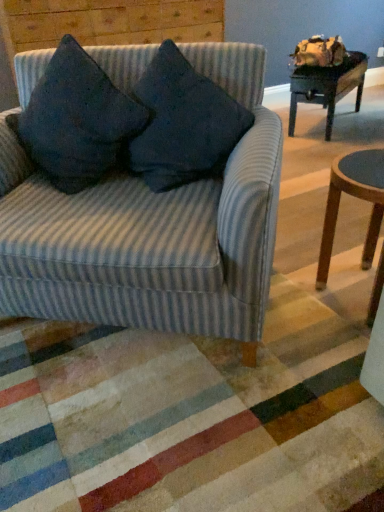
Describe the element at coordinates (77, 120) in the screenshot. The height and width of the screenshot is (512, 384). I see `dark blue fabric pillow at upper left, positioned as the second throw pillow in right-to-left order` at that location.

What do you see at coordinates (356, 197) in the screenshot? This screenshot has width=384, height=512. I see `wooden round stool at lower right` at bounding box center [356, 197].

In order to face dark blue fabric pillow at center, acting as the second throw pillow starting from the left, should I rotate leftwards or rightwards?

You should rotate left by 1.017 degrees.

What do you see at coordinates (183, 123) in the screenshot? The image size is (384, 512). I see `dark blue fabric pillow at center, which appears as the 1th throw pillow when viewed from the right` at bounding box center [183, 123].

At what (x,y) coordinates should I click in order to perform the action: click on dark blue fabric pillow at upper left, which appears as the first throw pillow when viewed from the left. Please return your answer as a coordinate pair (x, y). The image size is (384, 512). Looking at the image, I should click on (77, 120).

I want to click on dresser that is above the wooden round stool at lower right (from a real-world perspective), so click(x=103, y=25).

Is wooden round stool at lower right positioned beyond the bounds of dark blue fabric cushion at upper left?

Indeed, wooden round stool at lower right is completely outside dark blue fabric cushion at upper left.

In terms of height, does wooden round stool at lower right look taller or shorter compared to dark blue fabric cushion at upper left?

In the image, wooden round stool at lower right appears to be shorter than dark blue fabric cushion at upper left.

Is wooden round stool at lower right far from dark blue fabric cushion at upper left?

Yes, wooden round stool at lower right and dark blue fabric cushion at upper left are located far from each other.

Considering the sizes of objects wooden round stool at lower right and dark blue fabric pillow at upper left, positioned as the second throw pillow in right-to-left order, in the image provided, who is taller, wooden round stool at lower right or dark blue fabric pillow at upper left, positioned as the second throw pillow in right-to-left order,?

wooden round stool at lower right is taller.

Would you say wooden round stool at lower right is a long distance from dark blue fabric pillow at upper left, positioned as the second throw pillow in right-to-left order?

No, wooden round stool at lower right is not far away from dark blue fabric pillow at upper left, positioned as the second throw pillow in right-to-left order.

How many degrees apart are the facing directions of wooden round stool at lower right and dark blue fabric pillow at upper left, which appears as the first throw pillow when viewed from the left?

55.5 degrees.

Considering the relative sizes of wooden round stool at lower right and dark blue fabric pillow at upper left, positioned as the second throw pillow in right-to-left order, in the image provided, is wooden round stool at lower right wider than dark blue fabric pillow at upper left, positioned as the second throw pillow in right-to-left order,?

Correct, the width of wooden round stool at lower right exceeds that of dark blue fabric pillow at upper left, positioned as the second throw pillow in right-to-left order.

Is wooden table at upper right aimed at striped fabric couch at left?

No.

Which of these two, wooden table at upper right or striped fabric couch at left, is wider?

striped fabric couch at left.

Which object is positioned more to the left, wooden table at upper right or striped fabric couch at left?

From the viewer's perspective, striped fabric couch at left appears more on the left side.

Considering the sizes of dark blue fabric pillow at upper left, positioned as the second throw pillow in right-to-left order, and wooden table at upper right in the image, is dark blue fabric pillow at upper left, positioned as the second throw pillow in right-to-left order, wider or thinner than wooden table at upper right?

dark blue fabric pillow at upper left, positioned as the second throw pillow in right-to-left order, is wider than wooden table at upper right.

From a real-world perspective, is dark blue fabric pillow at upper left, positioned as the second throw pillow in right-to-left order, positioned above or below wooden table at upper right?

dark blue fabric pillow at upper left, positioned as the second throw pillow in right-to-left order, is above wooden table at upper right.

Based on their sizes in the image, would you say dark blue fabric pillow at upper left, positioned as the second throw pillow in right-to-left order, is bigger or smaller than wooden table at upper right?

In the image, dark blue fabric pillow at upper left, positioned as the second throw pillow in right-to-left order, appears to be smaller than wooden table at upper right.

There is a wooden table at upper right. Where is `the 2nd throw pillow above it (from a real-world perspective)`? the 2nd throw pillow above it (from a real-world perspective) is located at coordinates (77, 120).

Would you say dark blue fabric cushion at upper left is inside or outside dark blue fabric pillow at upper left, which appears as the first throw pillow when viewed from the left?

dark blue fabric cushion at upper left is spatially situated outside dark blue fabric pillow at upper left, which appears as the first throw pillow when viewed from the left.

Considering the sizes of dark blue fabric cushion at upper left and dark blue fabric pillow at upper left, which appears as the first throw pillow when viewed from the left, in the image, is dark blue fabric cushion at upper left taller or shorter than dark blue fabric pillow at upper left, which appears as the first throw pillow when viewed from the left,?

dark blue fabric cushion at upper left is taller than dark blue fabric pillow at upper left, which appears as the first throw pillow when viewed from the left.

Which is more distant, (68,21) or (94,82)?

Point (68,21)

Locate an element on the screen. The image size is (384, 512). dresser positioned vertically above the dark blue fabric pillow at upper left, positioned as the second throw pillow in right-to-left order (from a real-world perspective) is located at coordinates (103, 25).

Is striped fabric couch at left spatially inside dark blue fabric cushion at upper left, or outside of it?

striped fabric couch at left is outside dark blue fabric cushion at upper left.

Which is more distant, (104, 285) or (208, 26)?

Point (208, 26)

From a real-world perspective, is striped fabric couch at left located higher than dark blue fabric cushion at upper left?

Actually, striped fabric couch at left is physically below dark blue fabric cushion at upper left in the real world.

Which is more to the right, striped fabric couch at left or dark blue fabric cushion at upper left?

striped fabric couch at left is more to the right.

Is dark blue fabric pillow at center, acting as the second throw pillow starting from the left, further to the viewer compared to striped fabric couch at left?

Yes, it is.

Could you measure the distance between dark blue fabric pillow at center, acting as the second throw pillow starting from the left, and striped fabric couch at left?

They are 8.32 inches apart.

From the image's perspective, starting from the striped fabric couch at left, which throw pillow is the 1st one above? Please provide its 2D coordinates.

[(183, 123)]

Is dark blue fabric pillow at center, acting as the second throw pillow starting from the left, at the right side of striped fabric couch at left?

Correct, you'll find dark blue fabric pillow at center, acting as the second throw pillow starting from the left, to the right of striped fabric couch at left.

At what (x,y) coordinates should I click in order to perform the action: click on coffee table below the dark blue fabric cushion at upper left (from a real-world perspective). Please return your answer as a coordinate pair (x, y). The width and height of the screenshot is (384, 512). Looking at the image, I should click on (356, 197).

Locate an element on the screen. The image size is (384, 512). coffee table on the right side of dark blue fabric pillow at upper left, positioned as the second throw pillow in right-to-left order is located at coordinates (356, 197).

From the image, which object appears to be nearer to dark blue fabric pillow at upper left, which appears as the first throw pillow when viewed from the left, wooden table at upper right or dark blue fabric pillow at center, which appears as the 1th throw pillow when viewed from the right?

dark blue fabric pillow at center, which appears as the 1th throw pillow when viewed from the right, is closer to dark blue fabric pillow at upper left, which appears as the first throw pillow when viewed from the left.

Based on their spatial positions, is dark blue fabric pillow at center, which appears as the 1th throw pillow when viewed from the right, or striped fabric couch at left closer to wooden table at upper right?

Based on the image, dark blue fabric pillow at center, which appears as the 1th throw pillow when viewed from the right, appears to be nearer to wooden table at upper right.

Which object lies nearer to the anchor point dark blue fabric cushion at upper left, dark blue fabric pillow at upper left, which appears as the first throw pillow when viewed from the left, or dark blue fabric pillow at center, which appears as the 1th throw pillow when viewed from the right?

The object closer to dark blue fabric cushion at upper left is dark blue fabric pillow at upper left, which appears as the first throw pillow when viewed from the left.

Looking at the image, which one is located further to dark blue fabric pillow at center, which appears as the 1th throw pillow when viewed from the right, dark blue fabric pillow at upper left, positioned as the second throw pillow in right-to-left order, or wooden round stool at lower right?

wooden round stool at lower right lies further to dark blue fabric pillow at center, which appears as the 1th throw pillow when viewed from the right, than the other object.

Based on their spatial positions, is wooden round stool at lower right or wooden table at upper right closer to dark blue fabric pillow at center, which appears as the 1th throw pillow when viewed from the right?

wooden round stool at lower right is positioned closer to the anchor dark blue fabric pillow at center, which appears as the 1th throw pillow when viewed from the right.

Which object lies further to the anchor point dark blue fabric pillow at center, which appears as the 1th throw pillow when viewed from the right, striped fabric couch at left or wooden round stool at lower right?

wooden round stool at lower right is further to dark blue fabric pillow at center, which appears as the 1th throw pillow when viewed from the right.

Looking at the image, which one is located further to wooden round stool at lower right, striped fabric couch at left or dark blue fabric cushion at upper left?

The object further to wooden round stool at lower right is dark blue fabric cushion at upper left.

In the scene shown: Which object lies further to the anchor point wooden table at upper right, dark blue fabric cushion at upper left or dark blue fabric pillow at center, acting as the second throw pillow starting from the left?

dark blue fabric pillow at center, acting as the second throw pillow starting from the left, is further to wooden table at upper right.

This screenshot has width=384, height=512. In order to click on coffee table between dark blue fabric pillow at center, which appears as the 1th throw pillow when viewed from the right, and wooden table at upper right in the front-back direction in this screenshot , I will do `click(356, 197)`.

In order to click on dresser located between dark blue fabric pillow at center, which appears as the 1th throw pillow when viewed from the right, and wooden table at upper right in the depth direction in this screenshot , I will do `click(103, 25)`.

Where is `throw pillow situated between striped fabric couch at left and wooden round stool at lower right from left to right`? throw pillow situated between striped fabric couch at left and wooden round stool at lower right from left to right is located at coordinates (183, 123).

Locate an element on the screen. This screenshot has height=512, width=384. throw pillow between dark blue fabric pillow at upper left, which appears as the first throw pillow when viewed from the left, and wooden round stool at lower right from left to right is located at coordinates (183, 123).